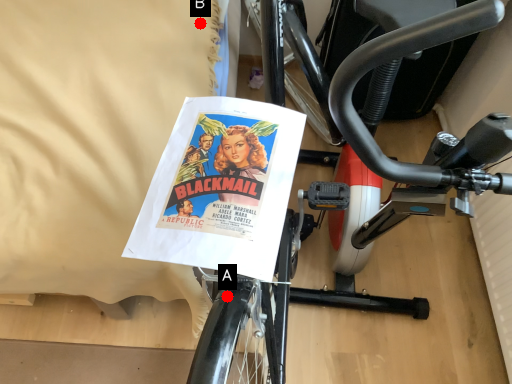
Question: Two points are circled on the image, labeled by A and B beside each circle. Which point is closer to the camera?

Choices:
 (A) A is closer
 (B) B is closer

Answer: (A)